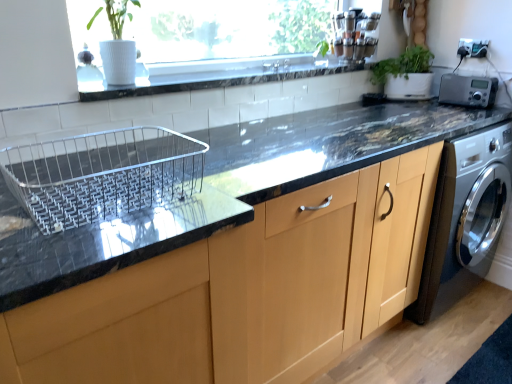
I want to click on empty space that is ontop of silver metallic radio at upper right (from a real-world perspective), so click(472, 73).